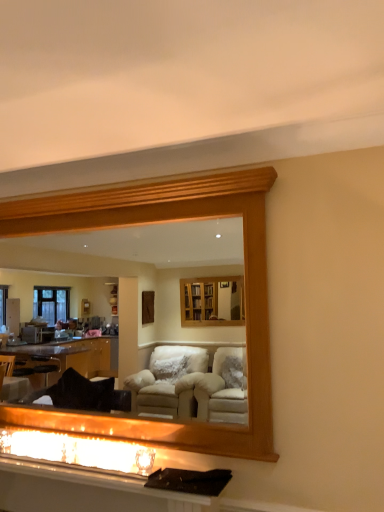
Question: Considering the relative positions of matte glass fireplace at lower center and matte white vanity at lower center in the image provided, is matte glass fireplace at lower center to the right of matte white vanity at lower center from the viewer's perspective?

Choices:
 (A) yes
 (B) no

Answer: (B)

Question: From the image's perspective, does matte glass fireplace at lower center appear higher than matte white vanity at lower center?

Choices:
 (A) no
 (B) yes

Answer: (B)

Question: Does matte glass fireplace at lower center have a larger size compared to matte white vanity at lower center?

Choices:
 (A) yes
 (B) no

Answer: (B)

Question: Is matte glass fireplace at lower center positioned before matte white vanity at lower center?

Choices:
 (A) no
 (B) yes

Answer: (A)

Question: Is matte glass fireplace at lower center to the left of matte white vanity at lower center from the viewer's perspective?

Choices:
 (A) yes
 (B) no

Answer: (A)

Question: In the image, is wooden frame at upper center on the left side or the right side of matte white vanity at lower center?

Choices:
 (A) right
 (B) left

Answer: (A)

Question: From a real-world perspective, is wooden frame at upper center physically located above or below matte white vanity at lower center?

Choices:
 (A) above
 (B) below

Answer: (A)

Question: Is wooden frame at upper center inside the boundaries of matte white vanity at lower center, or outside?

Choices:
 (A) outside
 (B) inside

Answer: (A)

Question: From the image's perspective, relative to matte white vanity at lower center, is wooden frame at upper center above or below?

Choices:
 (A) above
 (B) below

Answer: (A)

Question: Is point (1, 488) closer or farther from the camera than point (76, 445)?

Choices:
 (A) farther
 (B) closer

Answer: (A)

Question: From the image's perspective, relative to matte glass fireplace at lower center, is matte white vanity at lower center above or below?

Choices:
 (A) below
 (B) above

Answer: (A)

Question: Based on their positions, is matte white vanity at lower center located to the left or right of matte glass fireplace at lower center?

Choices:
 (A) right
 (B) left

Answer: (A)

Question: Is matte white vanity at lower center taller or shorter than matte glass fireplace at lower center?

Choices:
 (A) short
 (B) tall

Answer: (A)

Question: From a real-world perspective, is matte glass fireplace at lower center positioned above or below matte white vanity at lower center?

Choices:
 (A) below
 (B) above

Answer: (B)

Question: In terms of width, does matte glass fireplace at lower center look wider or thinner when compared to matte white vanity at lower center?

Choices:
 (A) thin
 (B) wide

Answer: (A)